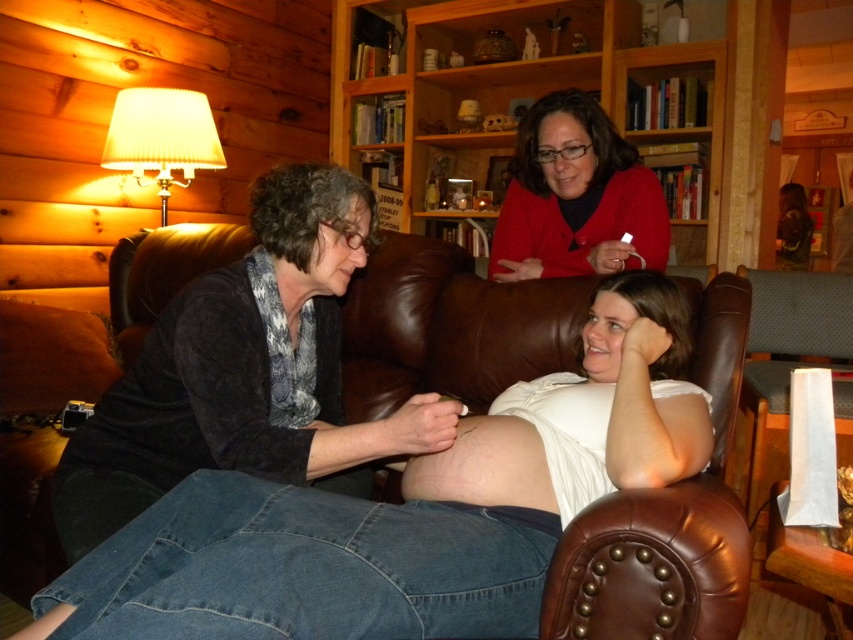
Question: Which object appears closest to the camera in this image?

Choices:
 (A) matte red sweater at upper center
 (B) wooden bookshelf at upper center
 (C) smooth skin belly at center
 (D) brown leather couch at center

Answer: (C)

Question: Can you confirm if brown leather couch at center is thinner than matte red sweater at upper center?

Choices:
 (A) no
 (B) yes

Answer: (A)

Question: Which of the following is the farthest from the observer?

Choices:
 (A) (210, 257)
 (B) (526, 444)
 (C) (601, 253)
 (D) (254, 403)

Answer: (A)

Question: Which point appears closest to the camera in this image?

Choices:
 (A) (216, 237)
 (B) (589, 81)
 (C) (332, 234)

Answer: (C)

Question: Is dark gray sweater at center smaller than matte red sweater at upper center?

Choices:
 (A) no
 (B) yes

Answer: (A)

Question: Considering the relative positions of wooden bookshelf at upper center and matte red sweater at upper center in the image provided, where is wooden bookshelf at upper center located with respect to matte red sweater at upper center?

Choices:
 (A) left
 (B) right

Answer: (B)